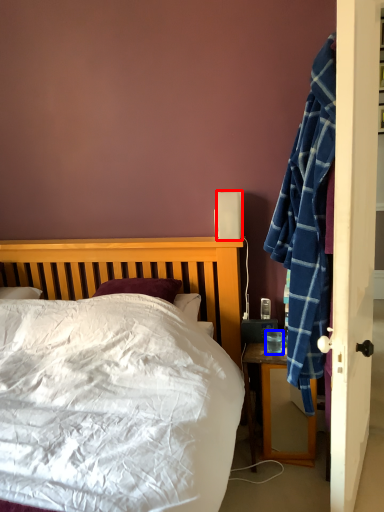
Question: Which point is closer to the camera, loudspeaker (highlighted by a red box) or coffee cup (highlighted by a blue box)?

Choices:
 (A) loudspeaker
 (B) coffee cup

Answer: (B)